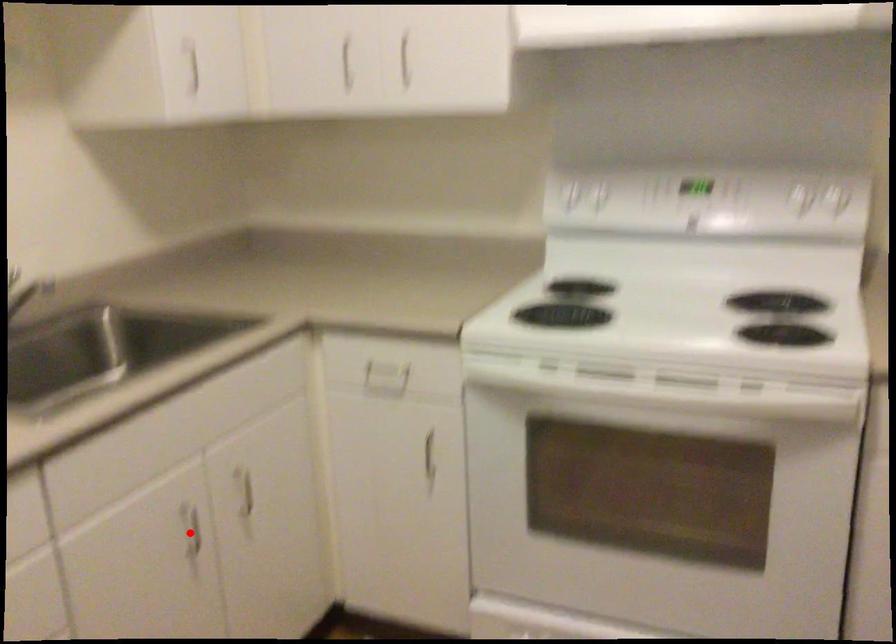
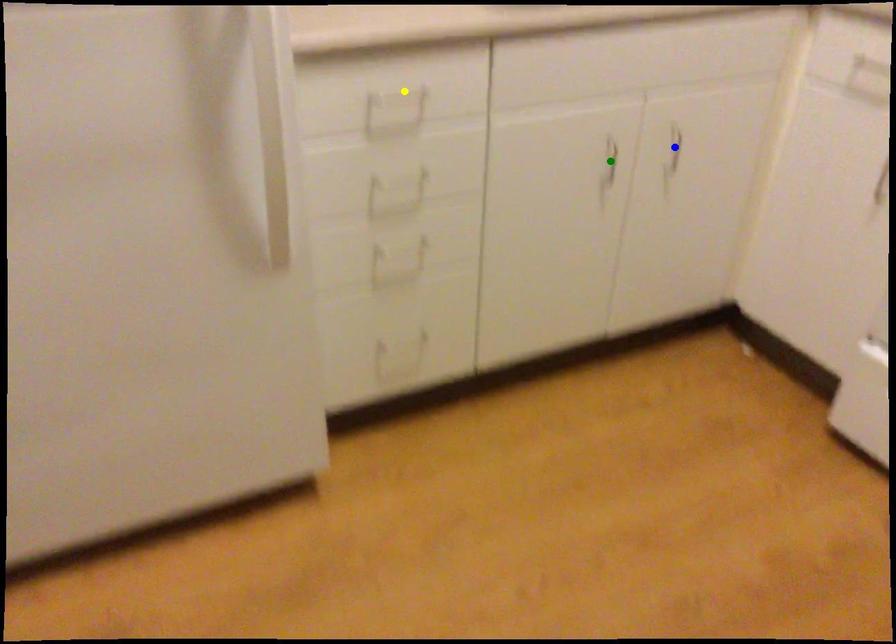
Question: I am providing you with two images of the same scene from different viewpoints. A red point is marked on the first image. You are given multiple points on the second image. Which mark in image 2 goes with the point in image 1?

Choices:
 (A) yellow point
 (B) green point
 (C) blue point

Answer: (B)